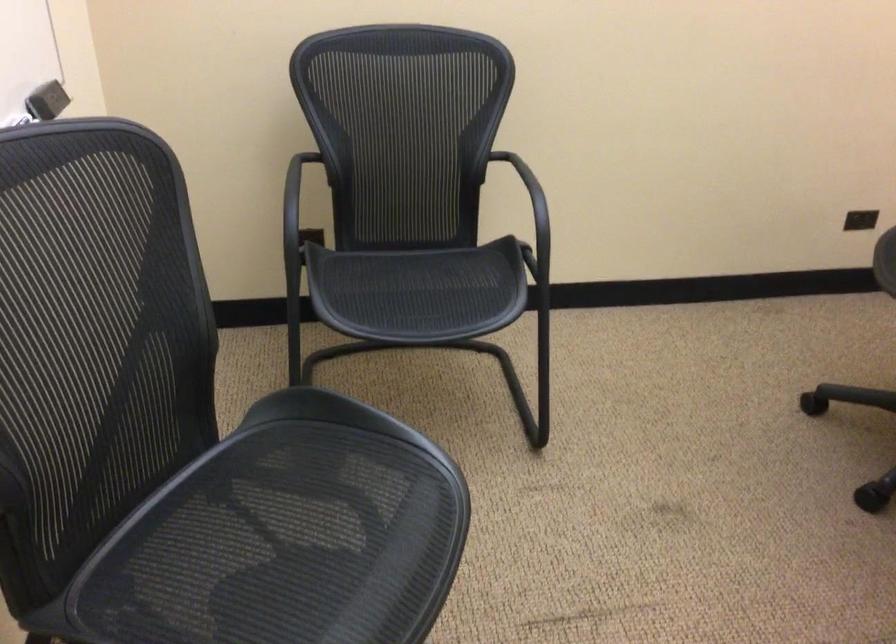
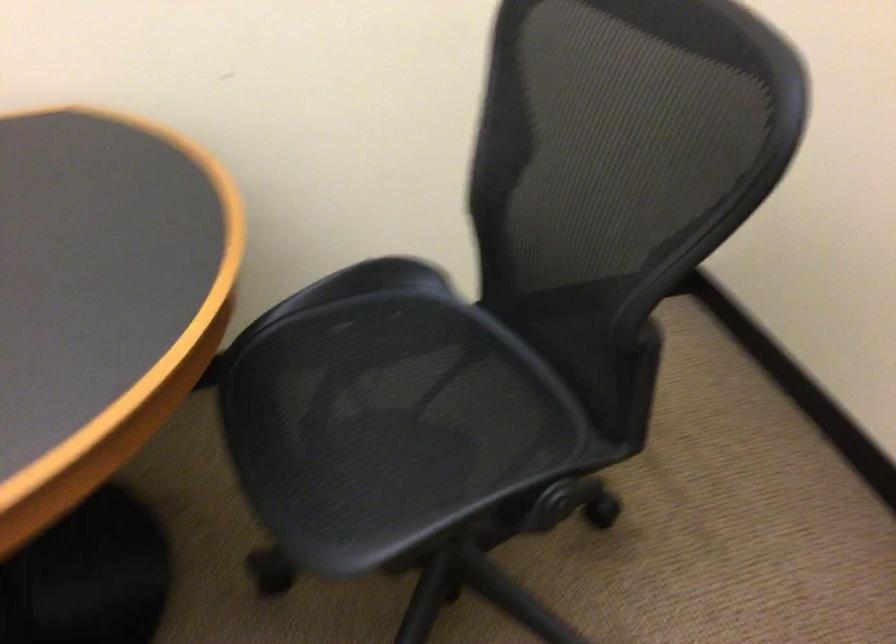
The images are taken continuously from a first-person perspective. In which direction is your viewpoint rotating?

The camera rotated toward right-down.